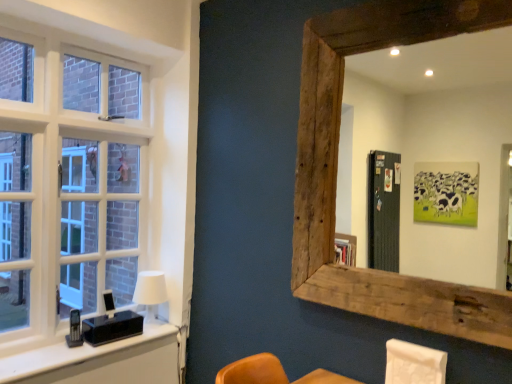
Identify the location of vacant space situated above white wood window at left (from a real-world perspective). (100, 49).